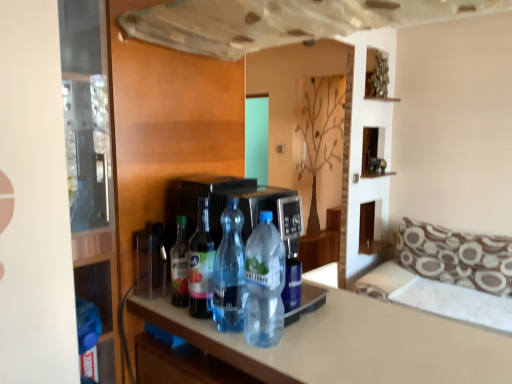
This screenshot has width=512, height=384. I want to click on empty space that is to the right of transparent plastic bottle at center, which appears as the 3th bottle when viewed from the left, so pyautogui.click(x=313, y=336).